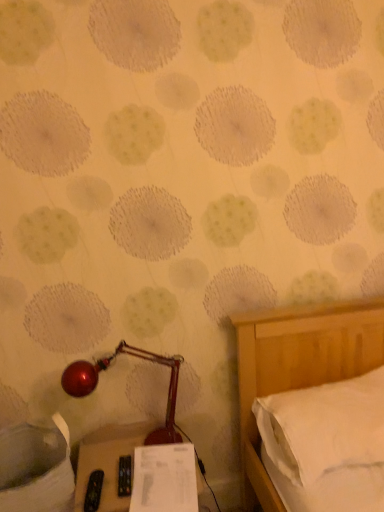
Question: Is white paper at lower center beside black plastic remote control at lower center?

Choices:
 (A) yes
 (B) no

Answer: (B)

Question: From the image's perspective, is white paper at lower center beneath black plastic remote control at lower center?

Choices:
 (A) yes
 (B) no

Answer: (B)

Question: Could you tell me if white paper at lower center is turned towards black plastic remote control at lower center?

Choices:
 (A) no
 (B) yes

Answer: (B)

Question: Is white paper at lower center wider than black plastic remote control at lower center?

Choices:
 (A) yes
 (B) no

Answer: (B)

Question: From a real-world perspective, is white paper at lower center physically above black plastic remote control at lower center?

Choices:
 (A) yes
 (B) no

Answer: (A)

Question: Considering the relative positions of white paper at lower center and black plastic remote control at lower center in the image provided, is white paper at lower center in front of black plastic remote control at lower center?

Choices:
 (A) yes
 (B) no

Answer: (B)

Question: Is white soft pillow at right looking in the opposite direction of white paper at lower center?

Choices:
 (A) no
 (B) yes

Answer: (A)

Question: Considering the relative sizes of white soft pillow at right and white paper at lower center in the image provided, is white soft pillow at right wider than white paper at lower center?

Choices:
 (A) no
 (B) yes

Answer: (B)

Question: Considering the relative sizes of white soft pillow at right and white paper at lower center in the image provided, is white soft pillow at right taller than white paper at lower center?

Choices:
 (A) yes
 (B) no

Answer: (A)

Question: Does white soft pillow at right have a smaller size compared to white paper at lower center?

Choices:
 (A) no
 (B) yes

Answer: (A)

Question: Is white soft pillow at right located outside white paper at lower center?

Choices:
 (A) yes
 (B) no

Answer: (A)

Question: Is white soft pillow at right positioned before white paper at lower center?

Choices:
 (A) yes
 (B) no

Answer: (B)

Question: From the image's perspective, is white soft pillow at right over shiny red lamp at lower left?

Choices:
 (A) no
 (B) yes

Answer: (A)